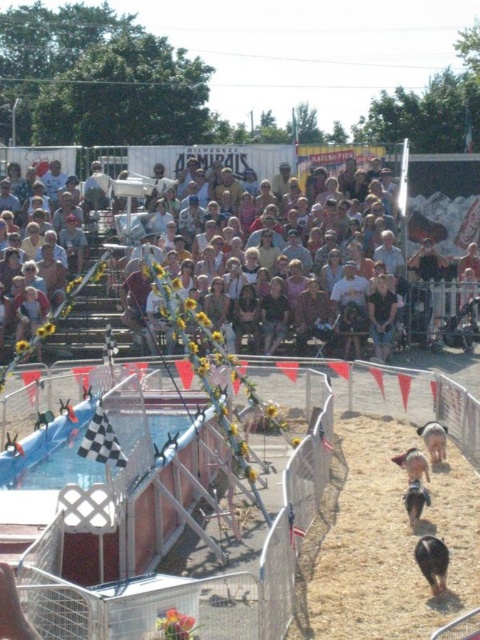
Can you confirm if matte yellow sunflowers at upper center is bigger than black fuzzy pig at lower right?

Correct, matte yellow sunflowers at upper center is larger in size than black fuzzy pig at lower right.

Between matte yellow sunflowers at upper center and black fuzzy pig at lower right, which one has less height?

Standing shorter between the two is black fuzzy pig at lower right.

What are the coordinates of `matte yellow sunflowers at upper center` in the screenshot? It's located at (437, 240).

Who is positioned more to the right, dark brown hair at center or black fuzzy pig at lower right?

From the viewer's perspective, black fuzzy pig at lower right appears more on the right side.

Is dark brown hair at center positioned behind black fuzzy pig at lower right?

Yes.

Is point (285, 324) positioned before point (444, 568)?

No, it is not.

Image resolution: width=480 pixels, height=640 pixels. Identify the location of dark brown hair at center. (274, 316).

Does point (410, 168) lie in front of point (429, 470)?

No, (410, 168) is further to viewer.

Can you confirm if matte yellow sunflowers at upper center is shorter than brown fuzzy pig at lower right?

No, matte yellow sunflowers at upper center is not shorter than brown fuzzy pig at lower right.

Measure the distance between point (338, 208) and camera.

A distance of 38.27 meters exists between point (338, 208) and camera.

The width and height of the screenshot is (480, 640). I want to click on matte yellow sunflowers at upper center, so click(437, 240).